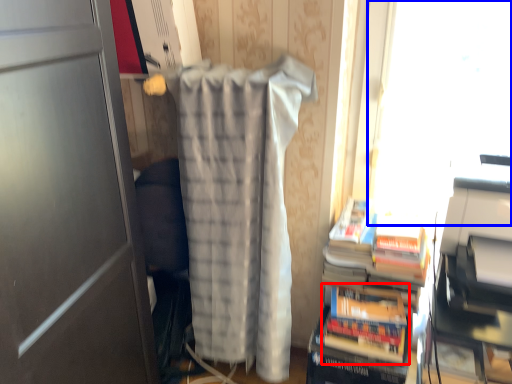
Question: Which point is closer to the camera, paperback book (highlighted by a red box) or window screen (highlighted by a blue box)?

Choices:
 (A) paperback book
 (B) window screen

Answer: (B)